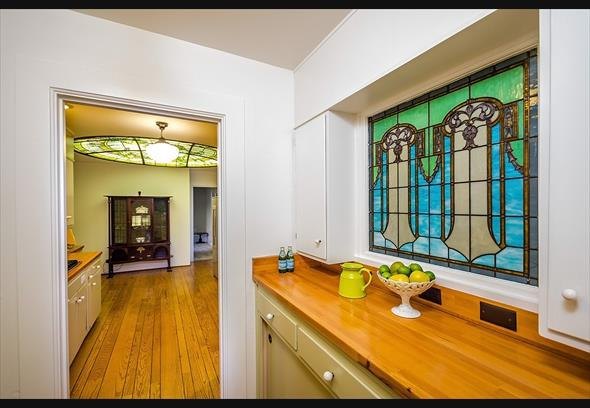
Find the location of `drawer`. drawer is located at coordinates (281, 335).